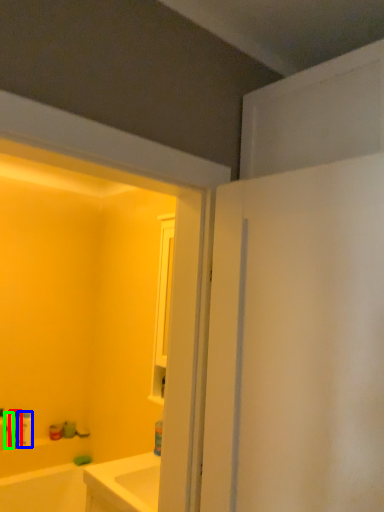
Question: Which object is the closest to the toiletry (highlighted by a red box)? Choose among these: toiletry (highlighted by a blue box) or toiletry (highlighted by a green box).

Choices:
 (A) toiletry
 (B) toiletry

Answer: (B)